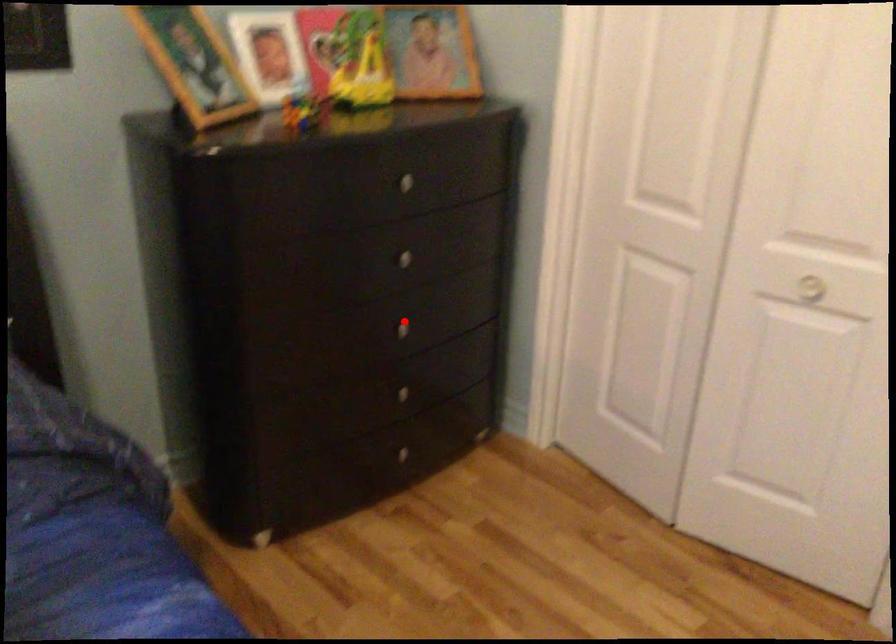
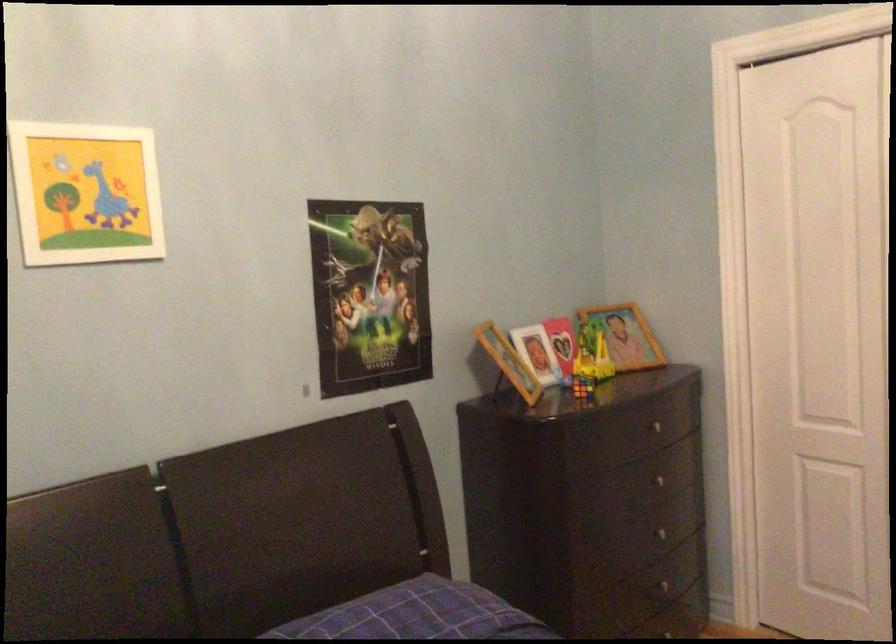
Question: I am providing you with two images of the same scene from different viewpoints. Image1 has a red point marked. In image2, the corresponding 3D location appears at what relative position? Reply with the corresponding letter.

Choices:
 (A) Closer
 (B) Farther

Answer: (B)